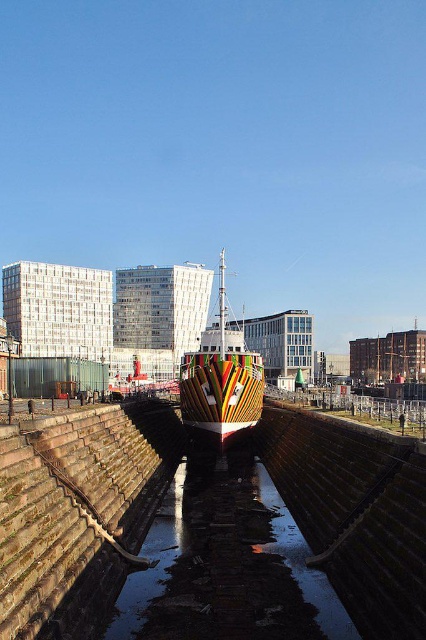
Who is higher up, dark reflective water at center or multicolored painted ship at center?

multicolored painted ship at center is higher up.

Which is behind, point (143, 584) or point (181, 413)?

The point (181, 413) is more distant.

I want to click on dark reflective water at center, so click(x=226, y=566).